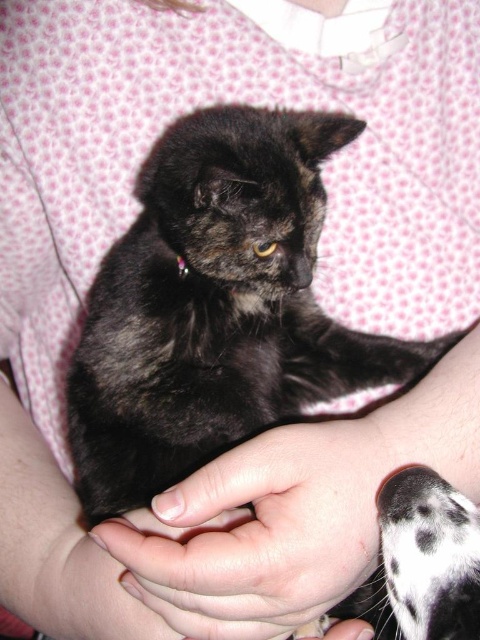
You are a veterinarian examining a cat. You observe the shiny black cat at center and the black and white fur at lower right. Which of these cats is taller?

The shiny black cat at center is taller than the black and white fur at lower right.

You are a veterinarian examining a kitten. You notice the smooth skin hand at center and the black and white fur at lower right. Which object is bigger?

The smooth skin hand at center is larger in size than black and white fur at lower right.

Consider the image. You are a photographer trying to position a red dot sticker exactly at the center of the image. The image has a shiny black cat at center. Where should you place the sticker relative to the cat?

The shiny black cat at center is already positioned at the center of the image, so place the red dot sticker directly on the cat at its center point.